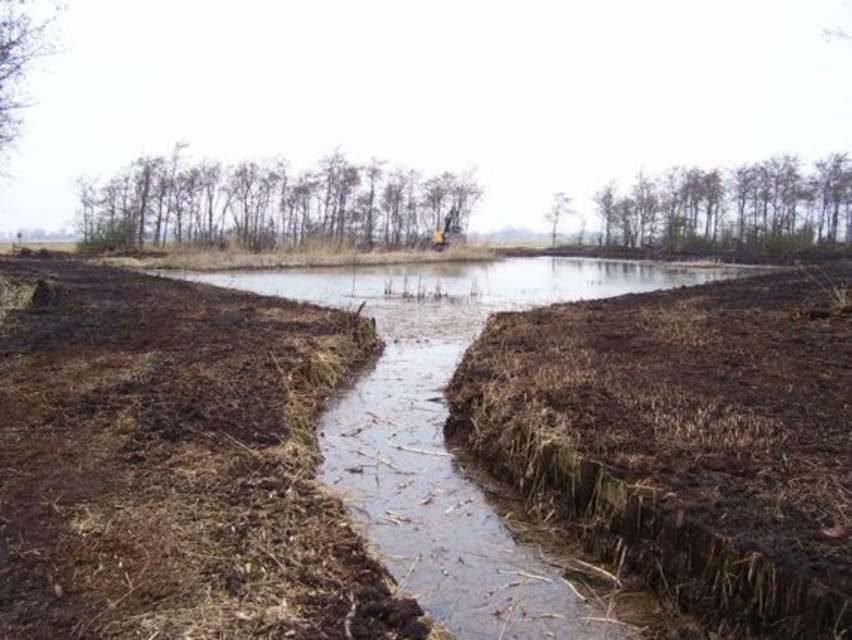
You are a farmer checking the irrigation system. You notice the brown dry grass at center and the brown muddy stream at center. Which one has a smaller width?

The brown dry grass at center is thinner than the brown muddy stream at center, so the brown dry grass at center has a smaller width.

You are standing at the edge of the scene and want to cross to the other side. You see the brown dry grass at center and the brown muddy stream at center. Which path would be better for walking without getting your shoes dirty?

The brown dry grass at center is closer to the viewer than the brown muddy stream at center, so walking on the brown dry grass at center would keep your shoes cleaner.

You are standing at the point marked as point [684,438] in the image. What type of terrain are you currently standing on?

The point [684,438] is on brown dry grass at center, so you are standing on brown dry grass.